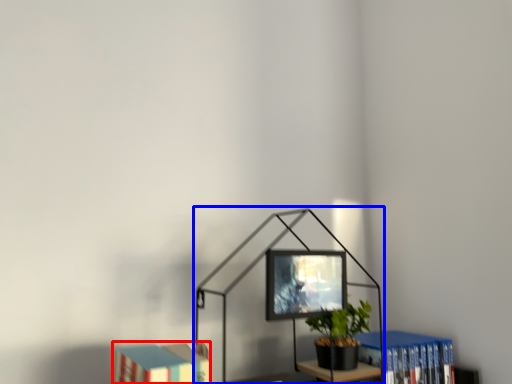
Question: Which object appears farthest to the camera in this image, book (highlighted by a red box) or table lamp (highlighted by a blue box)?

Choices:
 (A) book
 (B) table lamp

Answer: (B)